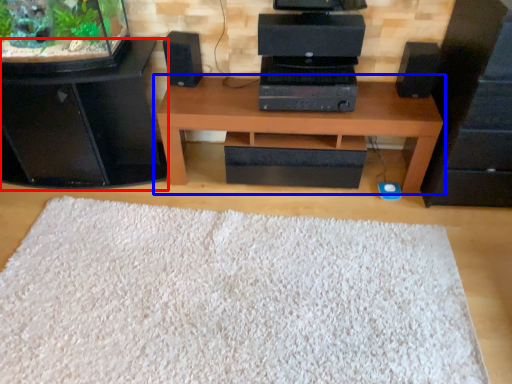
Question: Which of the following is the farthest to the observer, furniture (highlighted by a red box) or table (highlighted by a blue box)?

Choices:
 (A) furniture
 (B) table

Answer: (B)